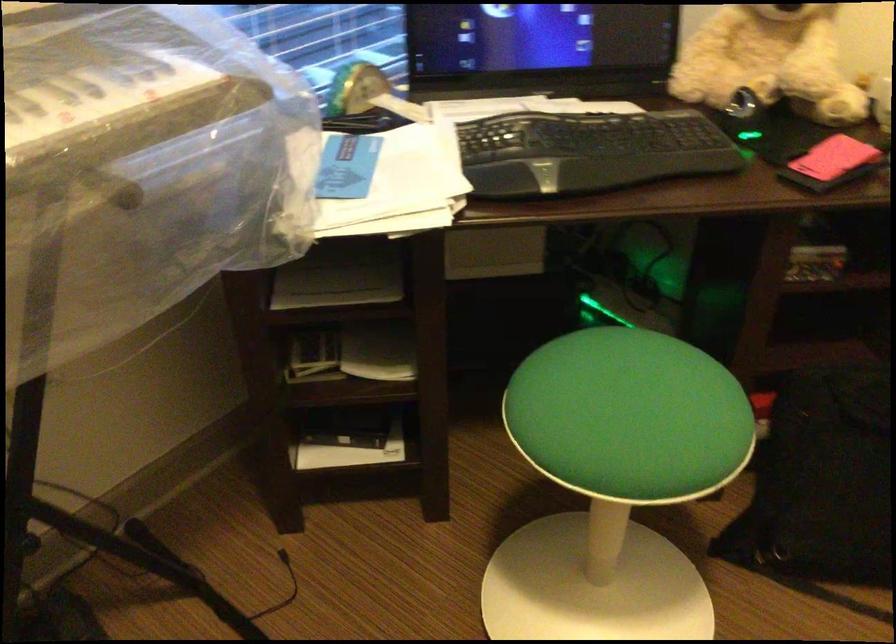
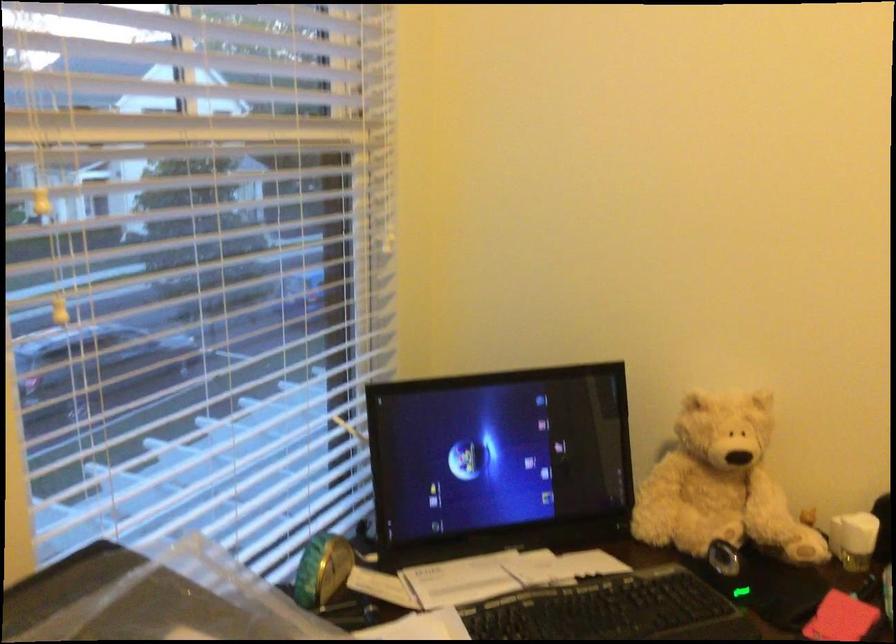
The point at (358, 76) is marked in the first image. Where is the corresponding point in the second image?

(322, 569)